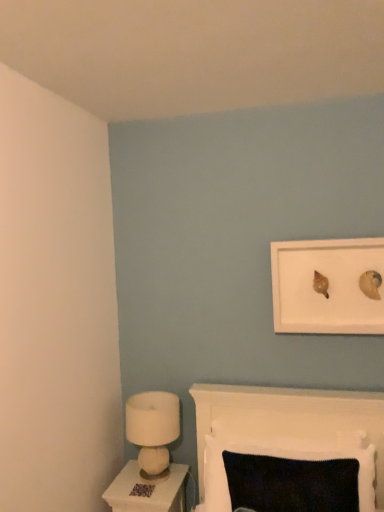
Question: Does white felt lamp at lower left appear on the right side of white glossy nightstand at lower left?

Choices:
 (A) yes
 (B) no

Answer: (A)

Question: Can you see white felt lamp at lower left touching white glossy nightstand at lower left?

Choices:
 (A) no
 (B) yes

Answer: (A)

Question: From a real-world perspective, is white felt lamp at lower left on white glossy nightstand at lower left?

Choices:
 (A) no
 (B) yes

Answer: (B)

Question: Is white felt lamp at lower left surrounding white glossy nightstand at lower left?

Choices:
 (A) no
 (B) yes

Answer: (A)

Question: Is the position of white felt lamp at lower left less distant than that of white glossy nightstand at lower left?

Choices:
 (A) no
 (B) yes

Answer: (A)

Question: Is the depth of white felt lamp at lower left greater than that of white glossy nightstand at lower left?

Choices:
 (A) no
 (B) yes

Answer: (B)

Question: Is white matte picture frame at upper right not within white glossy nightstand at lower left?

Choices:
 (A) yes
 (B) no

Answer: (A)

Question: Does white matte picture frame at upper right have a larger size compared to white glossy nightstand at lower left?

Choices:
 (A) no
 (B) yes

Answer: (A)

Question: Does white matte picture frame at upper right have a greater height compared to white glossy nightstand at lower left?

Choices:
 (A) no
 (B) yes

Answer: (B)

Question: From a real-world perspective, is white matte picture frame at upper right under white glossy nightstand at lower left?

Choices:
 (A) no
 (B) yes

Answer: (A)

Question: Can you confirm if white matte picture frame at upper right is positioned to the right of white glossy nightstand at lower left?

Choices:
 (A) no
 (B) yes

Answer: (B)

Question: Is white matte picture frame at upper right at the left side of white glossy nightstand at lower left?

Choices:
 (A) yes
 (B) no

Answer: (B)

Question: Is white matte picture frame at upper right wider than knitted fabric cushion at lower center?

Choices:
 (A) yes
 (B) no

Answer: (B)